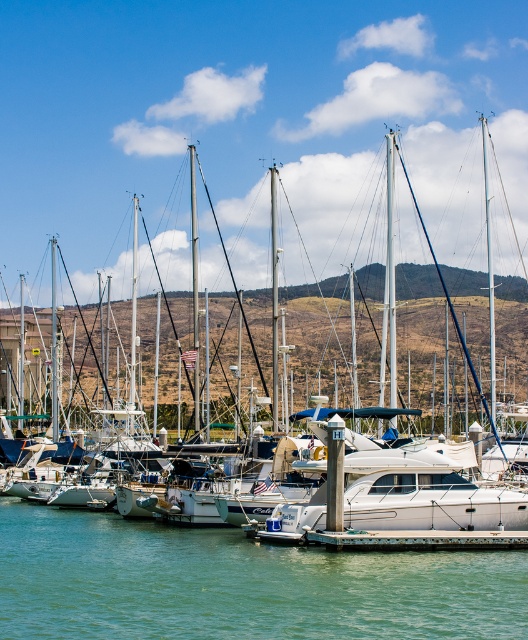
You are standing at the edge of the pier and notice two points marked on the image. The first point is at coordinates point (427, 237) and the second is at point (306, 538). If you want to touch both points starting from your current position, which point should you reach first?

You should reach point (427, 237) first because it is closer to you than point (306, 538), which is further away.

You are standing at the edge of the pier in the marina scene and notice two points marked on the water surface. The first point is labeled as point (425, 576) and the second is point (444, 545). If you want to reach the point that is closer to you, which one should you walk towards?

Point (425, 576) is in front of point (444, 545), so you should walk towards point (425, 576) to reach the one closer to you.

You are a boat captain trying to navigate your vessel through the marina. You see the green water at center and the rustic wood dock at center. Which one is wider?

The green water at center is wider than the rustic wood dock at center.